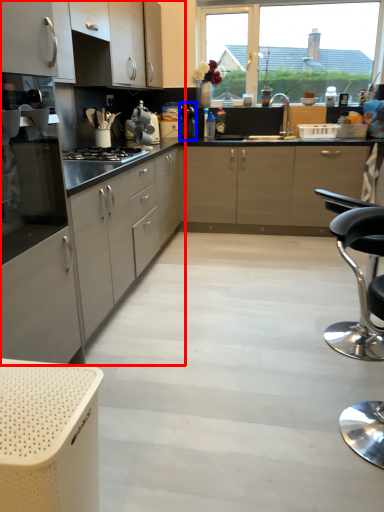
Question: Which object appears closest to the camera in this image, cabinetry (highlighted by a red box) or kitchen appliance (highlighted by a blue box)?

Choices:
 (A) cabinetry
 (B) kitchen appliance

Answer: (A)